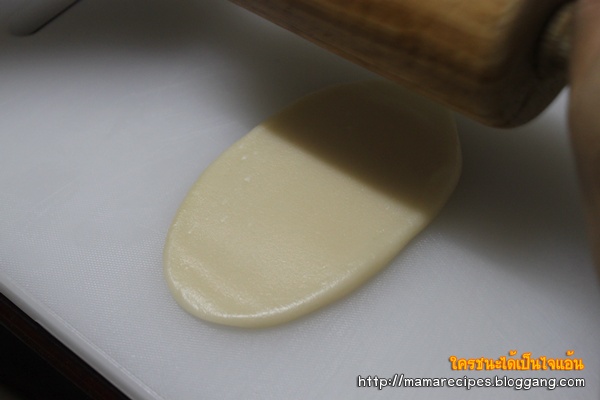
You are a GUI agent. You are given a task and a screenshot of the screen. Output one action in this format:
    pyautogui.click(x=<x>, y=<y>)
    Task: Click on the counter below, dough
    This screenshot has height=400, width=600.
    Given the screenshot: What is the action you would take?
    pyautogui.click(x=166, y=332)